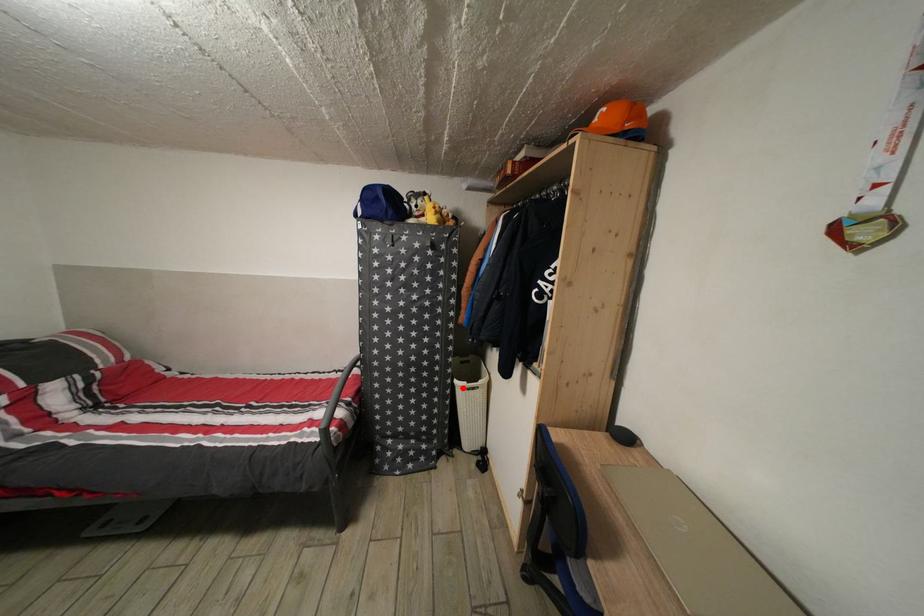
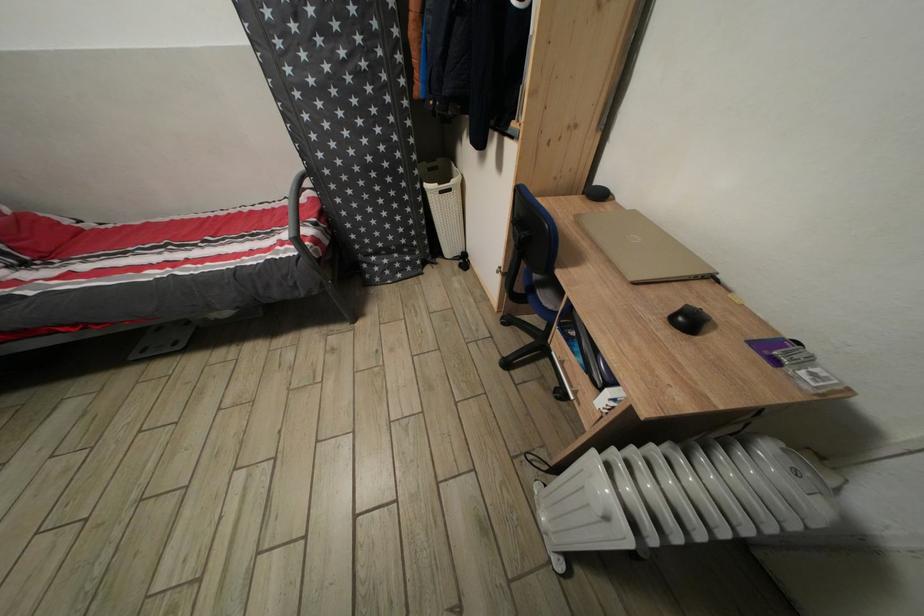
Locate, in the second image, the point that corresponds to the highlighted location in the first image.

(432, 192)